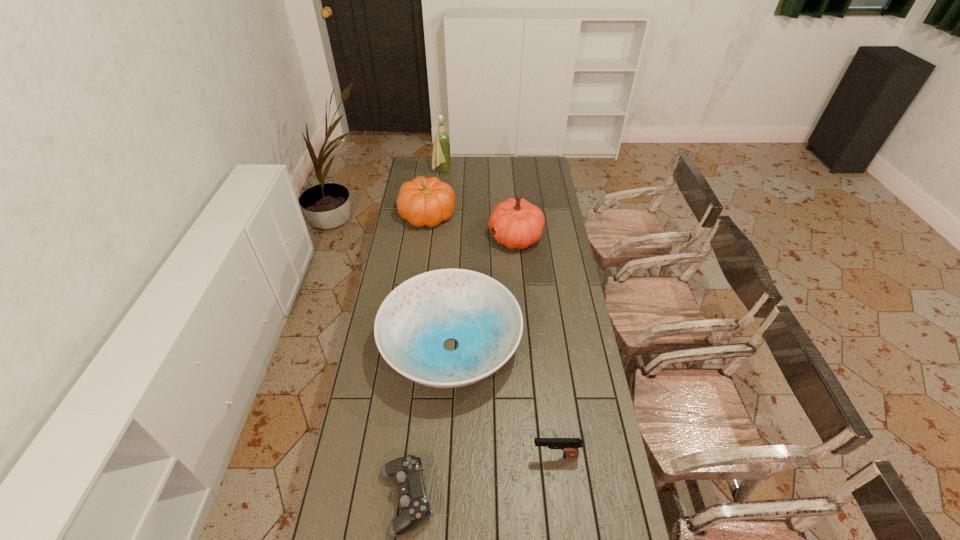
Locate an element on the screen. wine bottle is located at coordinates 441,150.

Image resolution: width=960 pixels, height=540 pixels. I want to click on the tallest object, so click(441, 150).

Identify the location of the right pumpkin. This screenshot has height=540, width=960. (517, 223).

Locate an element on the screen. The image size is (960, 540). the left pumpkin is located at coordinates (423, 201).

Locate an element on the screen. Image resolution: width=960 pixels, height=540 pixels. dish is located at coordinates (413, 322).

The width and height of the screenshot is (960, 540). In order to click on the third shortest object in this screenshot , I will do `click(413, 322)`.

Find the location of `pistol`. pistol is located at coordinates (570, 446).

Find the location of `the second shortest object`. the second shortest object is located at coordinates (570, 446).

The height and width of the screenshot is (540, 960). I want to click on vacant position located 0.080m on the front-facing side of the farthest object, so click(x=465, y=171).

Identify the location of vacant position located 0.370m on the front-facing side of the right pumpkin. The width and height of the screenshot is (960, 540). (414, 237).